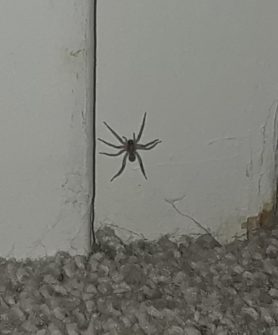
This screenshot has width=278, height=335. I want to click on empty space at the top of the wall, so click(x=26, y=129).